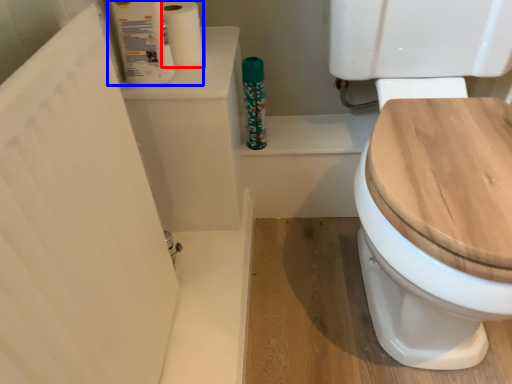
Question: Which object appears closest to the camera in this image, toilet paper (highlighted by a red box) or toilet paper (highlighted by a blue box)?

Choices:
 (A) toilet paper
 (B) toilet paper

Answer: (B)